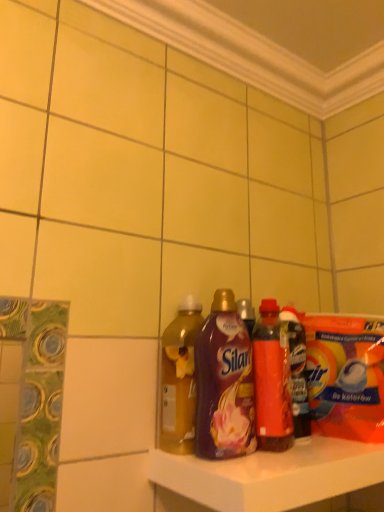
Where is `vacant area that is in front of purple plastic bottle at center, the second bottle in the left-to-right sequence`? The image size is (384, 512). vacant area that is in front of purple plastic bottle at center, the second bottle in the left-to-right sequence is located at coordinates (238, 465).